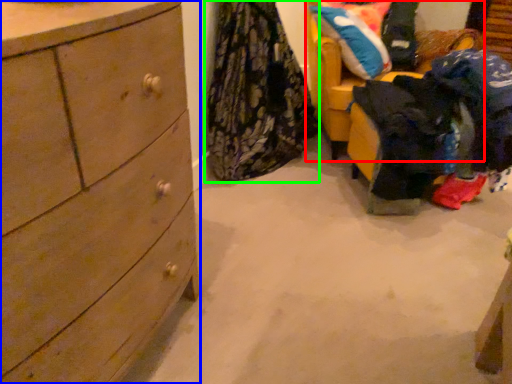
Question: Which object is positioned farthest from furniture (highlighted by a red box)? Select from chest of drawers (highlighted by a blue box) and clothing (highlighted by a green box).

Choices:
 (A) chest of drawers
 (B) clothing

Answer: (A)